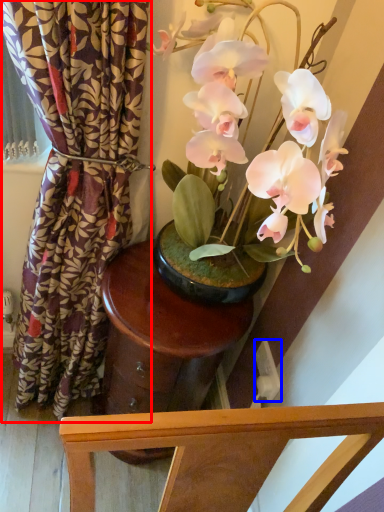
Question: Which object is further to the camera taking this photo, curtain (highlighted by a red box) or power outlet (highlighted by a blue box)?

Choices:
 (A) curtain
 (B) power outlet

Answer: (B)